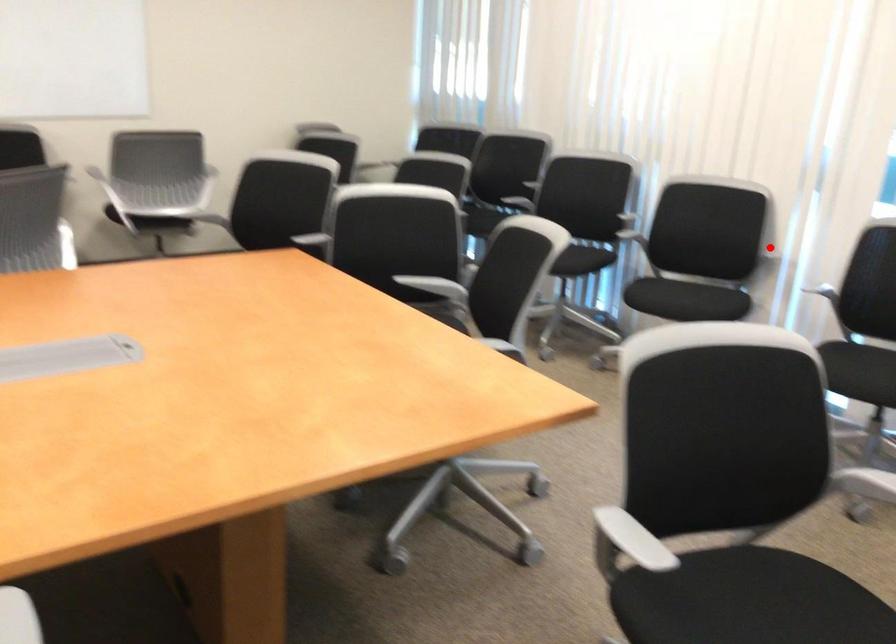
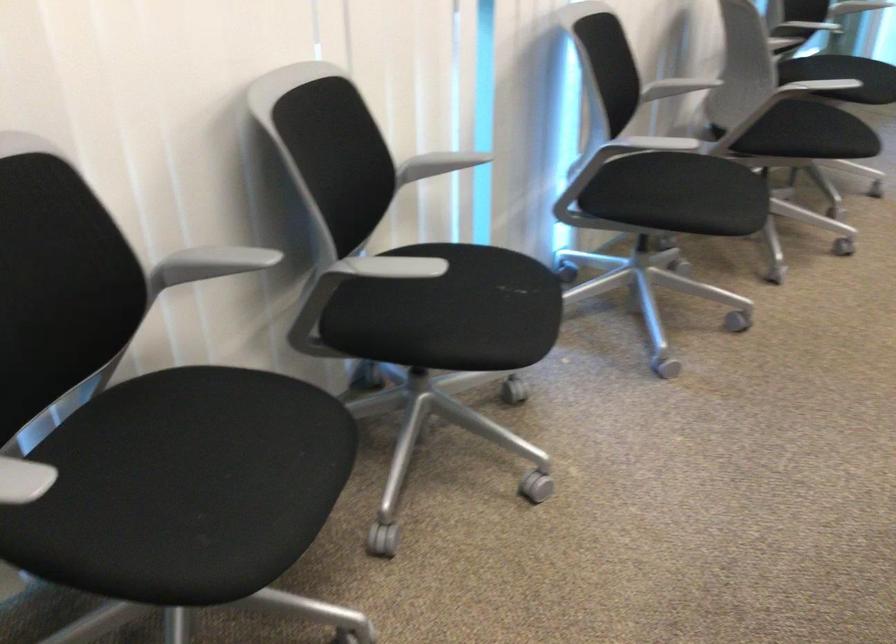
Where in the second image is the point corresponding to the highlighted location from the first image?

(438, 164)